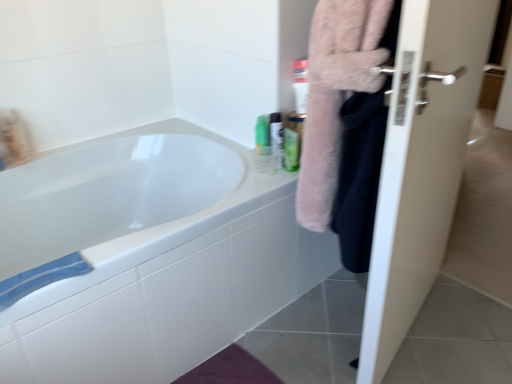
At what (x,y) coordinates should I click in order to perform the action: click on vacant space underneath fluffy pink towel at right, which is counted as the 2th bath towel, starting from the bottom (from a real-world perspective). Please return your answer as a coordinate pair (x, y). Looking at the image, I should click on (330, 334).